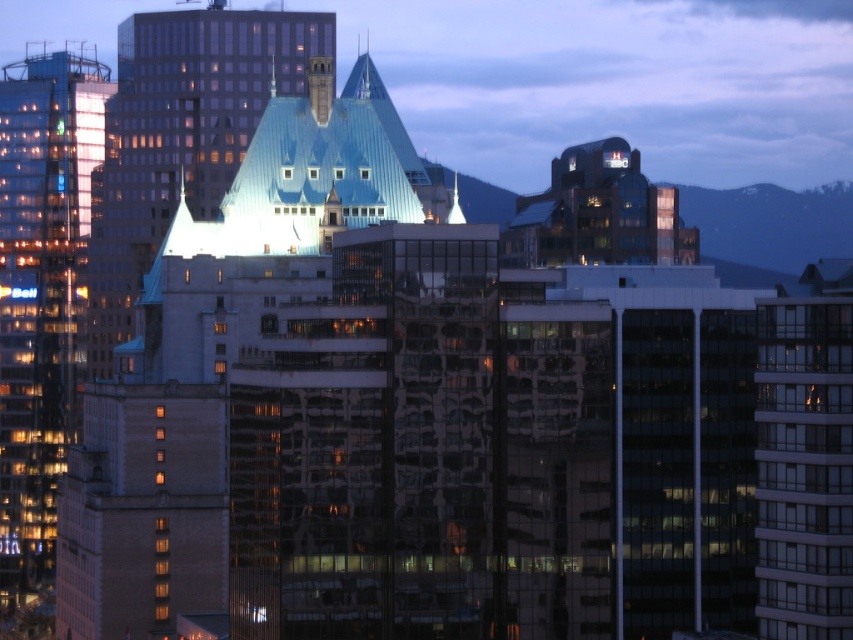
Can you confirm if glassy reflective skyscraper at left is thinner than blue glass building at center?

Yes, glassy reflective skyscraper at left is thinner than blue glass building at center.

Who is positioned more to the left, glassy reflective skyscraper at left or blue glass building at center?

Positioned to the left is glassy reflective skyscraper at left.

Is point (44, 588) positioned after point (132, 176)?

No, it is not.

This screenshot has width=853, height=640. I want to click on glassy reflective skyscraper at left, so click(x=42, y=294).